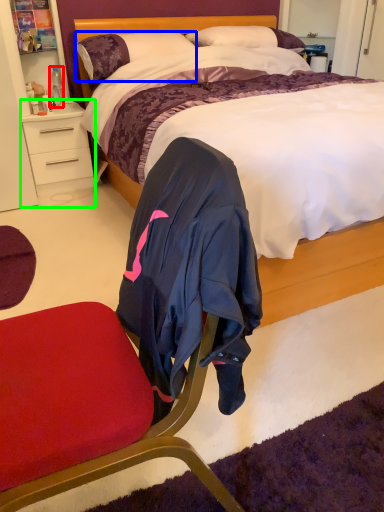
Question: Estimate the real-world distances between objects in this image. Which object is farther from bottle (highlighted by a red box), pillow (highlighted by a blue box) or desk (highlighted by a green box)?

Choices:
 (A) pillow
 (B) desk

Answer: (A)